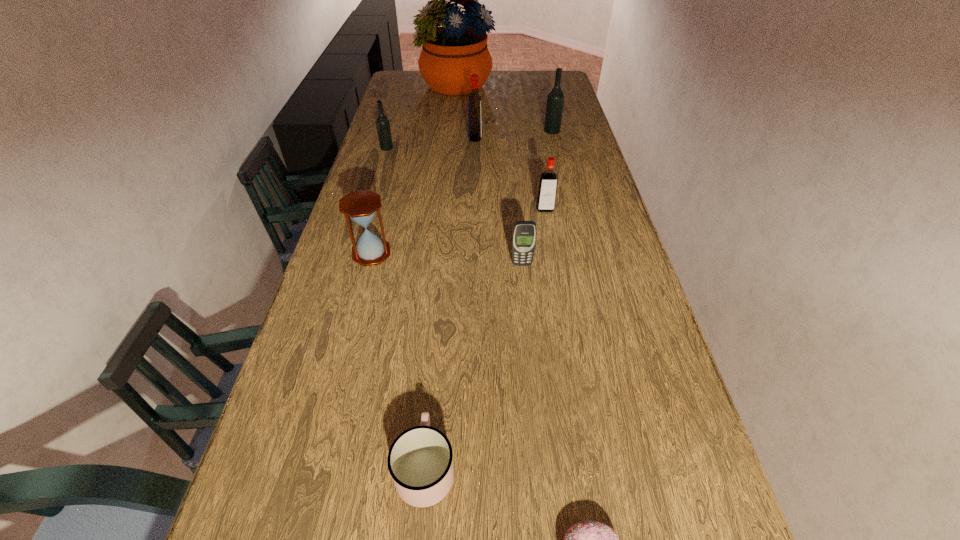
The width and height of the screenshot is (960, 540). I want to click on brown hourglass, so click(361, 206).

Find the location of a particular element. Image resolution: width=960 pixels, height=540 pixels. gray cellular telephone is located at coordinates (524, 234).

Locate an element on the screen. The height and width of the screenshot is (540, 960). the seventh tallest object is located at coordinates (524, 234).

In order to click on mug in this screenshot , I will do `click(420, 462)`.

Where is `the eighth tallest object`? This screenshot has height=540, width=960. the eighth tallest object is located at coordinates (420, 462).

Locate an element on the screen. Image resolution: width=960 pixels, height=540 pixels. free space located on the front of the tallest object is located at coordinates (452, 130).

Locate an element on the screen. Image resolution: width=960 pixels, height=540 pixels. free point located on the front and back of the bigger red vodka is located at coordinates (513, 138).

Identify the location of free space located on the front of the bigger black vodka. Image resolution: width=960 pixels, height=540 pixels. (561, 165).

At what (x,y) coordinates should I click in order to perform the action: click on free spot located on the front of the third farthest vodka. Please return your answer as a coordinate pair (x, y). This screenshot has width=960, height=540. Looking at the image, I should click on (381, 165).

Image resolution: width=960 pixels, height=540 pixels. I want to click on vacant space located on the front and back of the nearer red vodka, so pos(561,298).